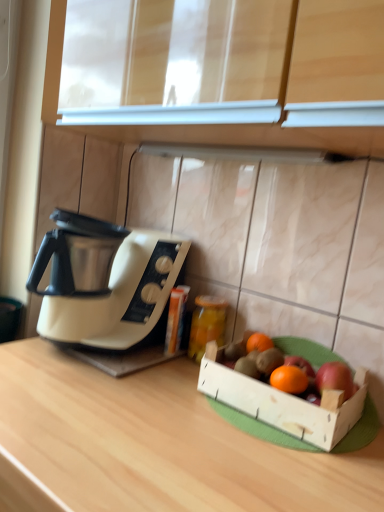
Image resolution: width=384 pixels, height=512 pixels. What do you see at coordinates (259, 342) in the screenshot?
I see `orange matte grapefruit at center, positioned as the 2th grapefruit in front-to-back order` at bounding box center [259, 342].

Find the location of a particular element. The image size is (384, 512). translucent glass jar at center is located at coordinates (207, 324).

The height and width of the screenshot is (512, 384). I want to click on white glossy exhaust hood at center, so click(x=242, y=153).

This screenshot has height=512, width=384. What do you see at coordinates (242, 153) in the screenshot? I see `white glossy exhaust hood at center` at bounding box center [242, 153].

The width and height of the screenshot is (384, 512). In order to click on wooden crate at right in this screenshot , I will do (284, 411).

What is the approximate height of white plastic coffee maker at left?

white plastic coffee maker at left is 12.74 inches tall.

Locate an element on the screen. orange matte grapefruit at center, positioned as the 2th grapefruit in front-to-back order is located at coordinates (259, 342).

Can you confirm if translucent glass jar at center is wider than white plastic coffee maker at left?

In fact, translucent glass jar at center might be narrower than white plastic coffee maker at left.

Considering the relative sizes of translucent glass jar at center and white plastic coffee maker at left in the image provided, is translucent glass jar at center smaller than white plastic coffee maker at left?

Yes, translucent glass jar at center is smaller than white plastic coffee maker at left.

Considering the sizes of objects translucent glass jar at center and white plastic coffee maker at left in the image provided, who is taller, translucent glass jar at center or white plastic coffee maker at left?

Standing taller between the two is white plastic coffee maker at left.

Between point (200, 354) and point (187, 248), which one is positioned behind?

Positioned behind is point (187, 248).

Between white plastic coffee maker at left and red matte apple at right, which one appears on the left side from the viewer's perspective?

Positioned to the left is white plastic coffee maker at left.

Considering the sizes of white plastic coffee maker at left and red matte apple at right in the image, is white plastic coffee maker at left taller or shorter than red matte apple at right?

Considering their sizes, white plastic coffee maker at left has more height than red matte apple at right.

Is point (60, 236) behind point (337, 389)?

Yes, point (60, 236) is behind point (337, 389).

Is wooden crate at right next to red matte apple at right and touching it?

wooden crate at right and red matte apple at right are clearly separated.

How many degrees apart are the facing directions of wooden crate at right and red matte apple at right?

wooden crate at right and red matte apple at right are facing 0.00625 degrees away from each other.

Which object is further away from the camera, wooden crate at right or red matte apple at right?

red matte apple at right is further away from the camera.

Can you confirm if wooden crate at right is taller than red matte apple at right?

Yes, wooden crate at right is taller than red matte apple at right.

From the image's perspective, is orange matte grapefruit at center, the 2th grapefruit from the back, above translucent glass jar at center?

Incorrect, from the image's perspective, orange matte grapefruit at center, the 2th grapefruit from the back, is lower than translucent glass jar at center.

From a real-world perspective, is orange matte grapefruit at center, the 2th grapefruit from the back, over translucent glass jar at center?

Yes, from a real-world perspective, orange matte grapefruit at center, the 2th grapefruit from the back, is over translucent glass jar at center

Would you say wooden crate at right contains white glossy exhaust hood at center?

No, wooden crate at right does not contain white glossy exhaust hood at center.

Consider the image. Measure the distance from wooden crate at right to white glossy exhaust hood at center.

wooden crate at right and white glossy exhaust hood at center are 20.08 inches apart from each other.

Considering the relative sizes of wooden crate at right and white glossy exhaust hood at center in the image provided, is wooden crate at right bigger than white glossy exhaust hood at center?

Yes, wooden crate at right is bigger than white glossy exhaust hood at center.

Does wooden crate at right turn towards white glossy exhaust hood at center?

No, wooden crate at right is not oriented towards white glossy exhaust hood at center.

What's the angular difference between white plastic coffee maker at left and orange matte grapefruit at center, marked as the first grapefruit in a back-to-front arrangement,'s facing directions?

1.91 degrees separate the facing orientations of white plastic coffee maker at left and orange matte grapefruit at center, marked as the first grapefruit in a back-to-front arrangement.

Could you tell me if white plastic coffee maker at left is turned towards orange matte grapefruit at center, marked as the first grapefruit in a back-to-front arrangement?

No, white plastic coffee maker at left is not facing towards orange matte grapefruit at center, marked as the first grapefruit in a back-to-front arrangement.

Are white plastic coffee maker at left and orange matte grapefruit at center, marked as the first grapefruit in a back-to-front arrangement, beside each other?

They are not placed beside each other.

Is point (252, 342) closer or farther from the camera than point (195, 309)?

Clearly, point (252, 342) is closer to the camera than point (195, 309).

From the image's perspective, is orange matte grapefruit at center, positioned as the 2th grapefruit in front-to-back order, above or below translucent glass jar at center?

From the image's perspective, orange matte grapefruit at center, positioned as the 2th grapefruit in front-to-back order, appears below translucent glass jar at center.

Measure the distance between orange matte grapefruit at center, marked as the first grapefruit in a back-to-front arrangement, and translucent glass jar at center.

orange matte grapefruit at center, marked as the first grapefruit in a back-to-front arrangement, and translucent glass jar at center are 4.79 inches apart.

This screenshot has height=512, width=384. I want to click on bottle below the white plastic coffee maker at left (from the image's perspective), so click(x=207, y=324).

You are a GUI agent. You are given a task and a screenshot of the screen. Output one action in this format:
    pyautogui.click(x=<x>, y=<y>)
    Task: Click on the apple lying on the right of white plastic coffee maker at left
    This screenshot has height=512, width=384.
    Given the screenshot: What is the action you would take?
    pyautogui.click(x=335, y=378)

Looking at this image, when comparing their distances from orange matte grapefruit at center, the first grapefruit when ordered from front to back, does wooden crate at right or orange matte grapefruit at center, marked as the first grapefruit in a back-to-front arrangement, seem further?

The object further to orange matte grapefruit at center, the first grapefruit when ordered from front to back, is orange matte grapefruit at center, marked as the first grapefruit in a back-to-front arrangement.

From the image, which object appears to be nearer to wooden crate at right, red matte apple at right or white glossy exhaust hood at center?

The object closer to wooden crate at right is red matte apple at right.

Which object lies nearer to the anchor point wooden at center, orange matte grapefruit at center, positioned as the 2th grapefruit in front-to-back order, or orange matte grapefruit at center, the first grapefruit when ordered from front to back?

Based on the image, orange matte grapefruit at center, the first grapefruit when ordered from front to back, appears to be nearer to wooden at center.

Looking at the image, which one is located further to orange matte grapefruit at center, positioned as the 2th grapefruit in front-to-back order, wooden at center or orange matte grapefruit at center, the first grapefruit when ordered from front to back?

The object further to orange matte grapefruit at center, positioned as the 2th grapefruit in front-to-back order, is wooden at center.

Which object lies nearer to the anchor point red matte apple at right, orange matte grapefruit at center, the first grapefruit when ordered from front to back, or wooden at center?

orange matte grapefruit at center, the first grapefruit when ordered from front to back, is closer to red matte apple at right.

Estimate the real-world distances between objects in this image. Which object is closer to wooden crate at right, red matte apple at right or orange matte grapefruit at center, marked as the first grapefruit in a back-to-front arrangement?

red matte apple at right.

Consider the image. Considering their positions, is white plastic coffee maker at left positioned further to wooden at center than wooden crate at right?

white plastic coffee maker at left.

When comparing their distances from red matte apple at right, does wooden at center or translucent glass jar at center seem closer?

wooden at center is positioned closer to the anchor red matte apple at right.

Identify the location of coffee maker between white glossy exhaust hood at center and orange matte grapefruit at center, marked as the first grapefruit in a back-to-front arrangement, vertically. The width and height of the screenshot is (384, 512). (106, 288).

At what (x,y) coordinates should I click in order to perform the action: click on apple positioned between wooden at center and translucent glass jar at center from near to far. Please return your answer as a coordinate pair (x, y). Looking at the image, I should click on (335, 378).

At what (x,y) coordinates should I click in order to perform the action: click on apple between white plastic coffee maker at left and wooden at center in the vertical direction. Please return your answer as a coordinate pair (x, y). Looking at the image, I should click on (335, 378).

Image resolution: width=384 pixels, height=512 pixels. I want to click on bottle between white plastic coffee maker at left and red matte apple at right, so click(x=207, y=324).